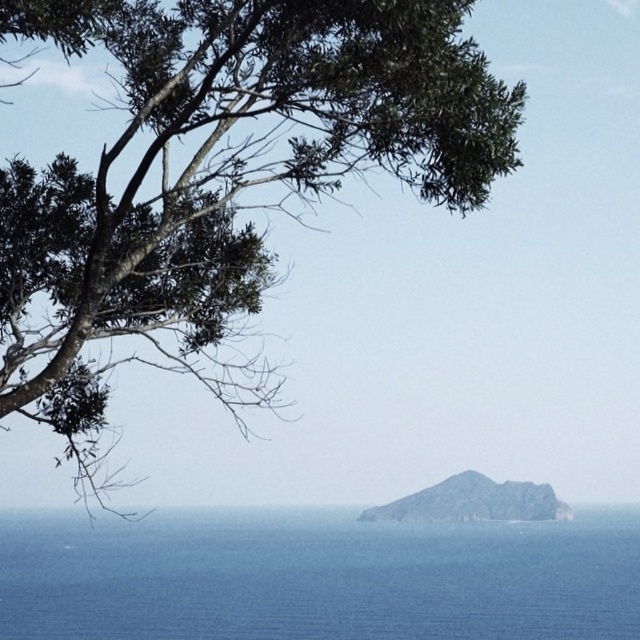
Question: Which point is farther from the camera taking this photo?

Choices:
 (A) (97, 209)
 (B) (433, 496)
 (C) (252, 605)

Answer: (B)

Question: Among these objects, which one is farthest from the camera?

Choices:
 (A) rugged stone island at center
 (B) green leafy tree at upper left

Answer: (A)

Question: Estimate the real-world distances between objects in this image. Which object is closer to the rugged stone island at center?

Choices:
 (A) green leafy tree at upper left
 (B) blue water at center

Answer: (B)

Question: Can you confirm if green leafy tree at upper left is positioned below rugged stone island at center?

Choices:
 (A) yes
 (B) no

Answer: (B)

Question: Does blue water at center have a larger size compared to rugged stone island at center?

Choices:
 (A) no
 (B) yes

Answer: (B)

Question: In this image, where is green leafy tree at upper left located relative to blue water at center?

Choices:
 (A) left
 (B) right

Answer: (A)